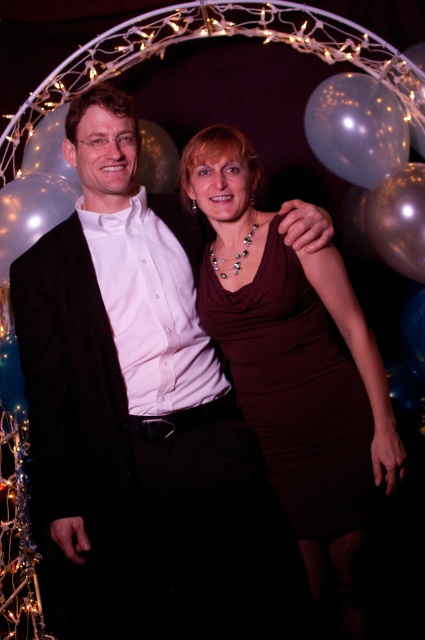
Is burgundy satin dress at center in front of metallic gold balloon at upper right?

That is True.

Does burgundy satin dress at center have a larger size compared to metallic gold balloon at upper right?

Correct, burgundy satin dress at center is larger in size than metallic gold balloon at upper right.

The image size is (425, 640). I want to click on burgundy satin dress at center, so click(295, 392).

The image size is (425, 640). What are the coordinates of `burgundy satin dress at center` in the screenshot? It's located at (295, 392).

Who is positioned more to the left, transparent plastic balloon at upper right or transparent plastic balloon at left?

transparent plastic balloon at left is more to the left.

In the scene shown: Can you confirm if transparent plastic balloon at upper right is bigger than transparent plastic balloon at left?

Correct, transparent plastic balloon at upper right is larger in size than transparent plastic balloon at left.

Between point (407, 140) and point (0, 262), which one is positioned in front?

Point (0, 262)

You are a GUI agent. You are given a task and a screenshot of the screen. Output one action in this format:
    pyautogui.click(x=<x>, y=<y>)
    Task: Click on the transparent plastic balloon at upper right
    The image size is (425, 640).
    Given the screenshot: What is the action you would take?
    pyautogui.click(x=357, y=128)

Does burgundy satin dress at center lie in front of transparent plastic balloon at upper right?

Yes, it is.

Where is `burgundy satin dress at center`? This screenshot has height=640, width=425. burgundy satin dress at center is located at coordinates (295, 392).